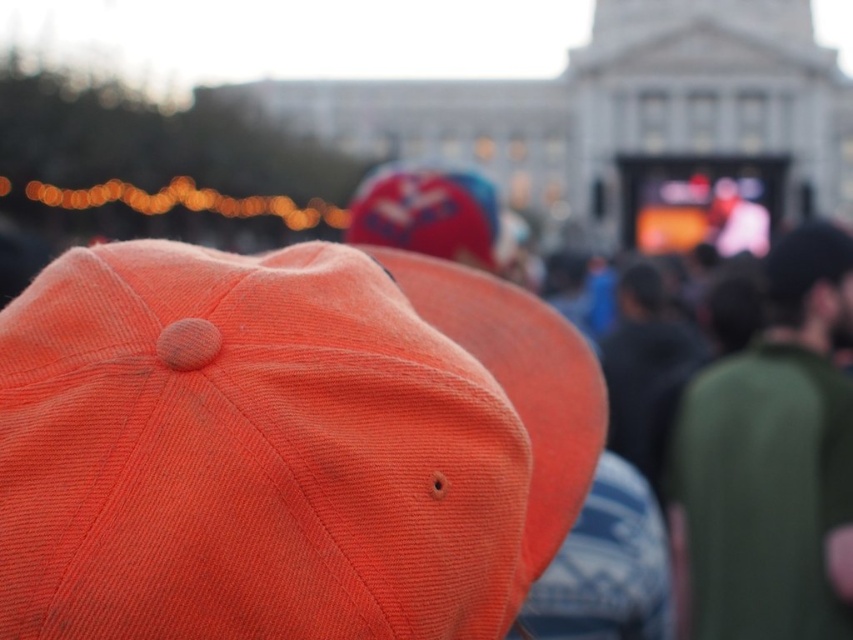
You are a photographer standing at the front of the scene. You want to take a photo that includes both the orange corduroy baseball cap at center and the green cotton shirt at right. Given that your camera has a maximum focus range of 40 meters, will you be able to capture both subjects in focus?

The orange corduroy baseball cap at center and the green cotton shirt at right are 40.88 meters apart. Since the distance between them exceeds the camera maximum focus range of 40 meters, the photographer cannot capture both subjects in focus.

You are a photographer trying to capture a clear shot of the orange corduroy baseball cap at center and the green cotton shirt at right. Since the background is blurred, which object should you focus on to ensure it appears sharp in the photo?

You should focus on the orange corduroy baseball cap at center because it is closer to the viewer and will remain sharp, while the green cotton shirt at right is farther away and may be more affected by the blurred background.

You are a photographer trying to focus on the orange corduroy baseball cap at center. Given that the camera is set to focus on the point at coordinates point (x=282, y=445), will the orange corduroy baseball cap at center be in focus?

Yes, the orange corduroy baseball cap at center is marked by the point (x=282, y=445), so the camera will focus on it.